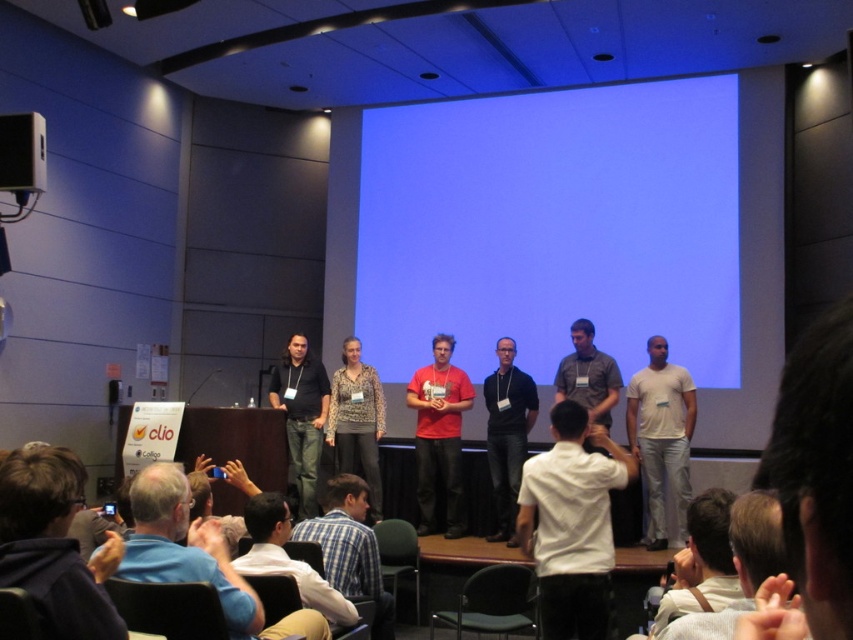
Question: Which of these objects is positioned closest to the blue shirt at lower left?

Choices:
 (A) white matte shirt at center
 (B) dark blue hoodie at lower left

Answer: (B)

Question: Which point is farther from the camera taking this photo?

Choices:
 (A) (451, 497)
 (B) (312, 376)

Answer: (B)

Question: Is blue matte projection screen at upper center below gray shirt at center?

Choices:
 (A) yes
 (B) no

Answer: (B)

Question: Considering the real-world distances, which object is closest to the white matte t-shirt at center?

Choices:
 (A) dark gray shirt at center
 (B) matte black shirt at center
 (C) blue plaid shirt at lower center

Answer: (A)

Question: Can you confirm if matte black shirt at center is wider than white shirt at center?

Choices:
 (A) no
 (B) yes

Answer: (A)

Question: Can you confirm if light brown leather jacket at lower right is positioned to the left of dark gray shirt at center?

Choices:
 (A) no
 (B) yes

Answer: (A)